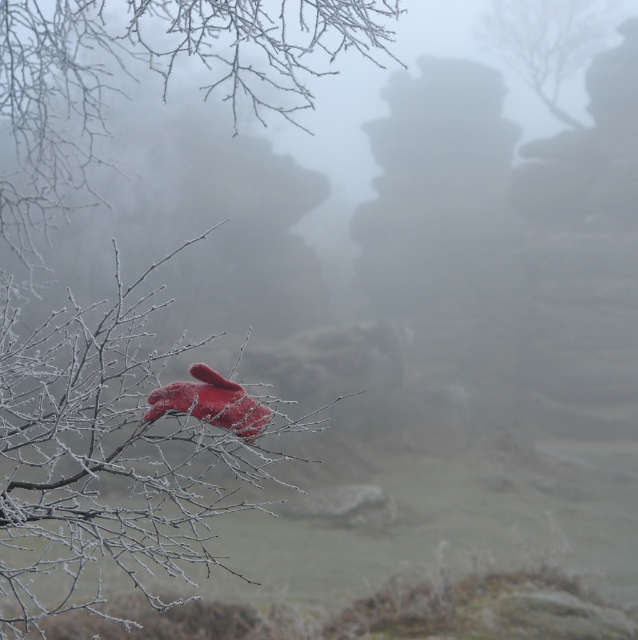
You are an artist trying to paint the winter scene. You want to ensure the frosted branches at upper left and the smooth bark tree at upper right are proportionally accurate. Which object should you paint as taller?

The frosted branches at upper left should be painted as taller than the smooth bark tree at upper right because the frosted branches at upper left is much taller as smooth bark tree at upper right.

You are an observer in this winter scene. You notice the frosted branches at upper left and the smooth bark tree at upper right. Which of these two objects appears bigger in the image?

The frosted branches at upper left appears bigger in the image compared to the smooth bark tree at upper right as stated in the description.